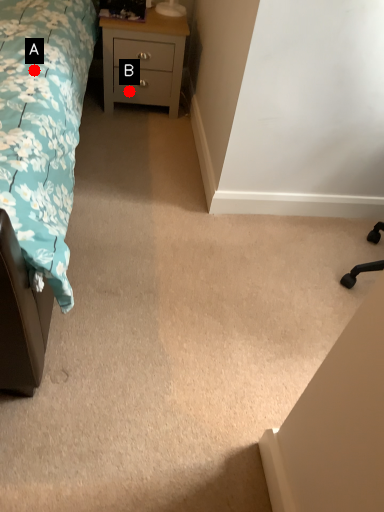
Question: Two points are circled on the image, labeled by A and B beside each circle. Which point is farther to the camera?

Choices:
 (A) A is further
 (B) B is further

Answer: (B)